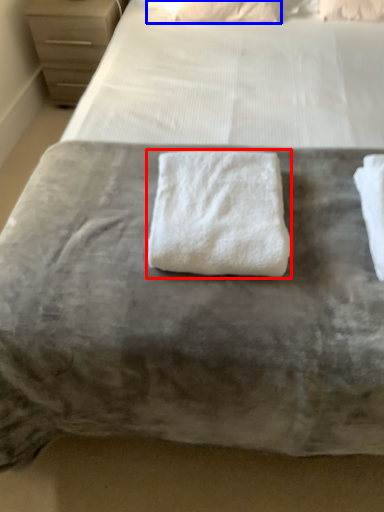
Question: Which of the following is the farthest to the observer, towel (highlighted by a red box) or pillow (highlighted by a blue box)?

Choices:
 (A) towel
 (B) pillow

Answer: (B)